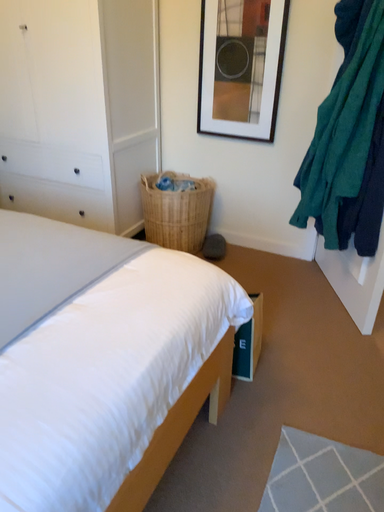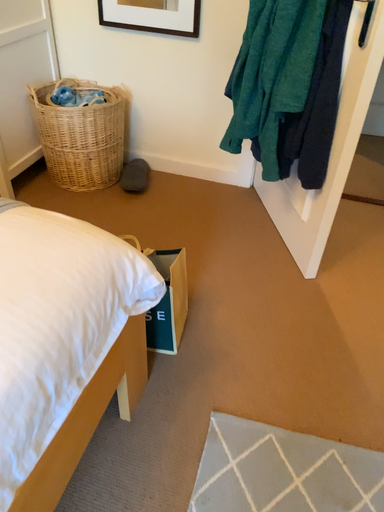
Question: Which way did the camera rotate in the video?

Choices:
 (A) rotated upward
 (B) rotated downward

Answer: (B)